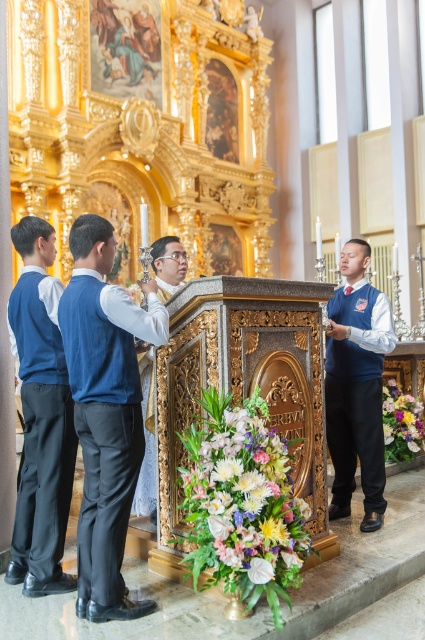
Is floral bouquet at lower center further to the viewer compared to blue velvet vest at right?

No, floral bouquet at lower center is closer to the viewer.

Does floral bouquet at lower center appear under blue velvet vest at right?

Indeed, floral bouquet at lower center is positioned under blue velvet vest at right.

Who is more forward, (204,525) or (346,278)?

Point (204,525) is in front.

Find the location of a particular element. floral bouquet at lower center is located at coordinates click(x=241, y=499).

Between floral bouquet at lower center and vibrant floral bouquet at lower right, which one is positioned higher?

Positioned higher is floral bouquet at lower center.

Is point (283, 520) more distant than point (410, 436)?

No.

Where is `floral bouquet at lower center`? This screenshot has width=425, height=640. floral bouquet at lower center is located at coordinates (241, 499).

Between matte gold vest at center and vibrant floral bouquet at lower right, which one has less height?

With less height is vibrant floral bouquet at lower right.

Based on the photo, does matte gold vest at center have a smaller size compared to vibrant floral bouquet at lower right?

Yes, matte gold vest at center is smaller than vibrant floral bouquet at lower right.

The height and width of the screenshot is (640, 425). In order to click on matte gold vest at center in this screenshot , I will do `click(147, 460)`.